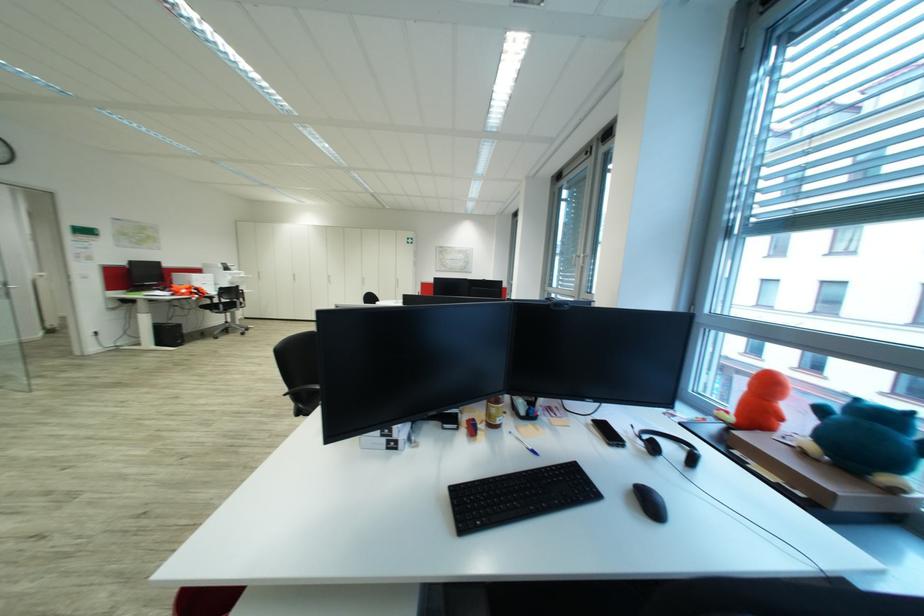
The location [524,443] corresponds to which object?

It corresponds to the blue ballpoint pen in the image.